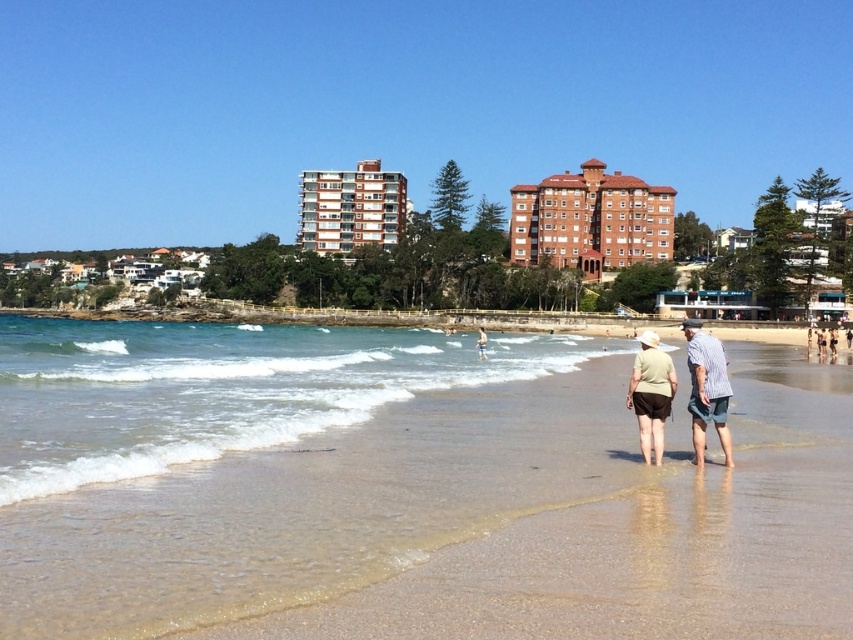
Question: Can you confirm if light brown wooden surfboard at center is thinner than light brown shorts at lower center?

Choices:
 (A) no
 (B) yes

Answer: (A)

Question: Is clear water at lower center thinner than light brown wooden surfboard at center?

Choices:
 (A) no
 (B) yes

Answer: (A)

Question: Which point is closer to the camera?

Choices:
 (A) (718, 387)
 (B) (474, 340)
 (C) (619, 209)
 (D) (712, 401)

Answer: (D)

Question: Is clear water at lower center further to the viewer compared to khaki cotton shirt at center?

Choices:
 (A) yes
 (B) no

Answer: (B)

Question: Which is farther from the clear water at lower center?

Choices:
 (A) light brown wooden surfboard at center
 (B) brown brick building at upper center
 (C) brown sand at lower center

Answer: (A)

Question: Which of these objects is positioned farthest from the brown brick building at upper center?

Choices:
 (A) light brown wooden surfboard at center
 (B) light brown shorts at lower center
 (C) striped cotton shirt at lower right

Answer: (A)